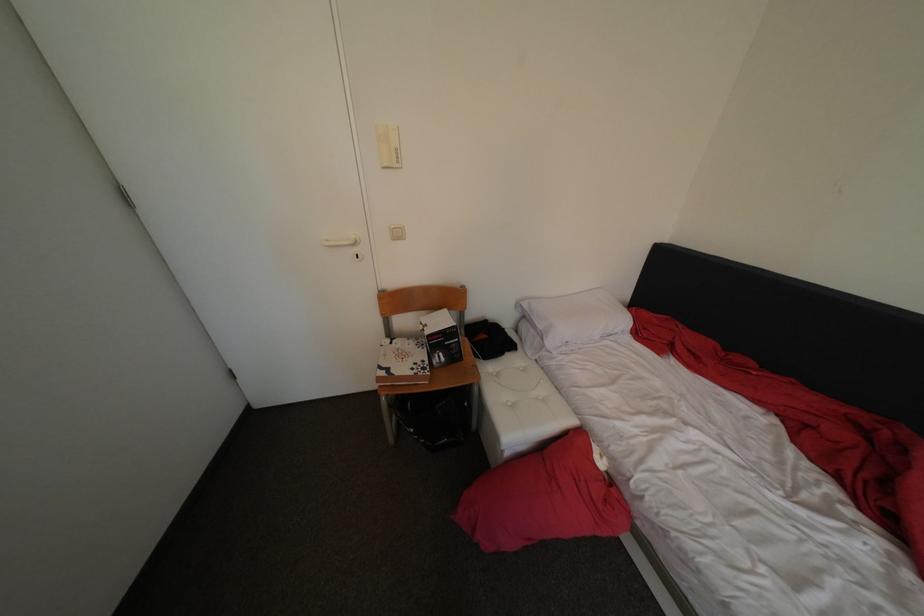
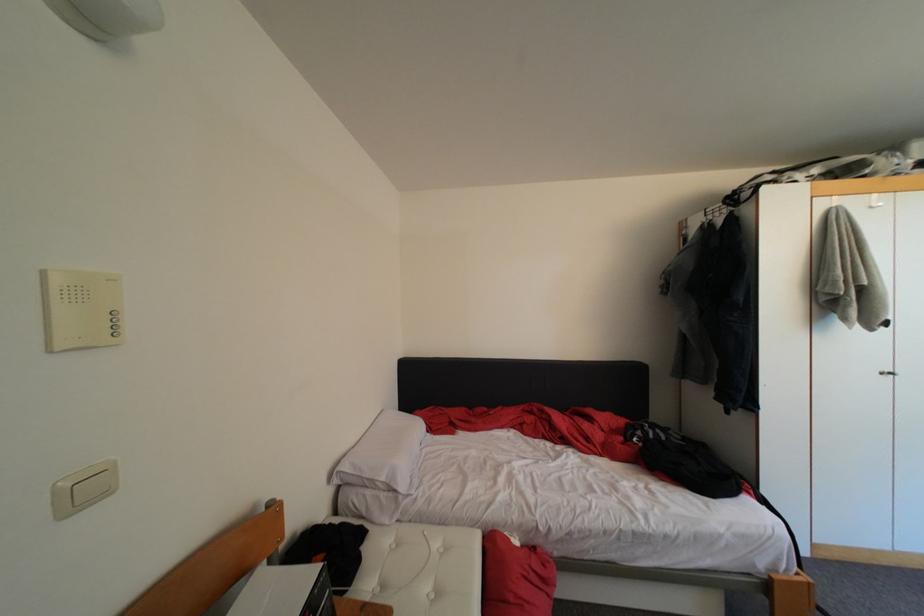
Question: Based on the continuous images, in which direction is the camera rotating? Reply with the corresponding letter.

Choices:
 (A) Left
 (B) Right
 (C) Up
 (D) Down

Answer: (B)